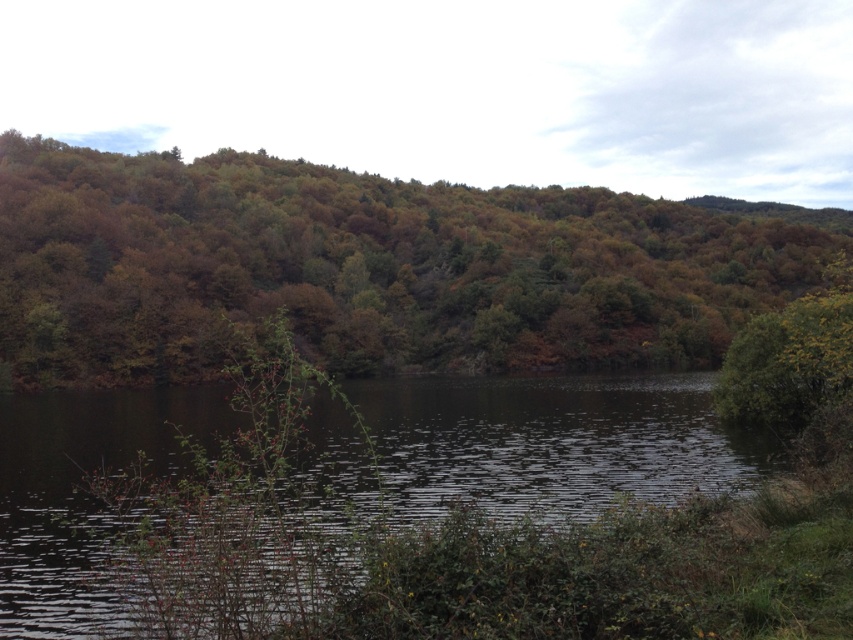
Question: Can you confirm if green matte tree at center is wider than dark reflective water at center?

Choices:
 (A) no
 (B) yes

Answer: (B)

Question: Is green matte tree at center to the right of dark reflective water at center from the viewer's perspective?

Choices:
 (A) yes
 (B) no

Answer: (A)

Question: Is green matte tree at center further to the viewer compared to dark reflective water at center?

Choices:
 (A) no
 (B) yes

Answer: (B)

Question: Which object is closer to the camera taking this photo?

Choices:
 (A) green matte tree at center
 (B) dark reflective water at center

Answer: (B)